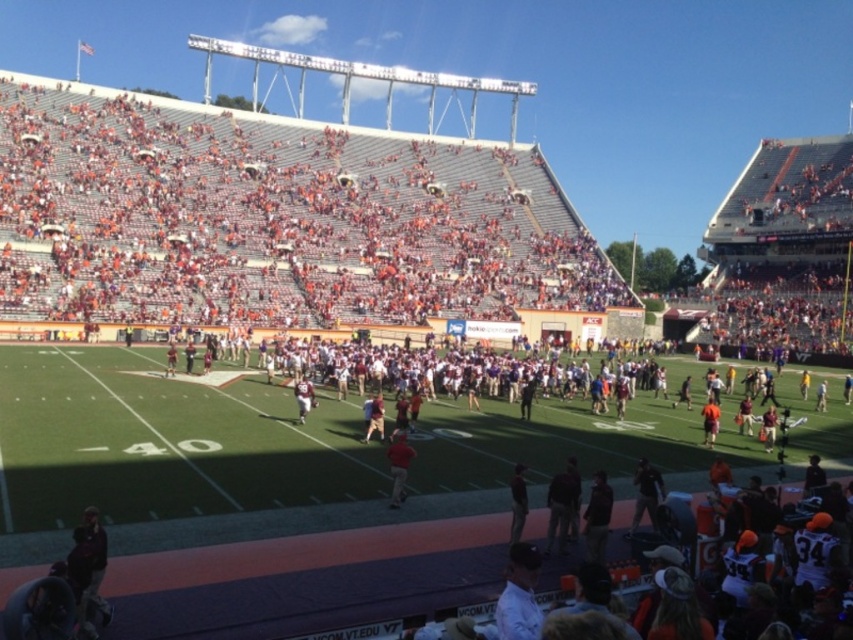
You are a photographer at the football stadium and want to capture a photo of the orange fabric person at center without any obstructions. Given that the tan fabric pants at center is currently blocking the view, can you adjust your position to take the photo? Explain your reasoning.

The tan fabric pants at center is in front of the orange fabric person at center, so moving to a position behind the orange fabric person at center or to the sides of the tan fabric pants at center would allow you to take the photo without obstruction.

You are a photographer at the football stadium. You want to capture a photo that shows both the tan fabric pants at center and the matte red jersey at center clearly. Based on their positions, which object should you focus on first to ensure both are in focus?

The tan fabric pants at center is in front of the matte red jersey at center. To ensure both are in focus, you should focus on the tan fabric pants at center first since it is closer, allowing the matte red jersey at center to be within the depth of field.

You are a photographer at the football stadium and want to capture a photo of the dark brown leather jacket at center and the tan fabric pants at center. Based on their positions, which one should appear higher in the photo?

The tan fabric pants at center should appear higher in the photo because the dark brown leather jacket at center is positioned below it.